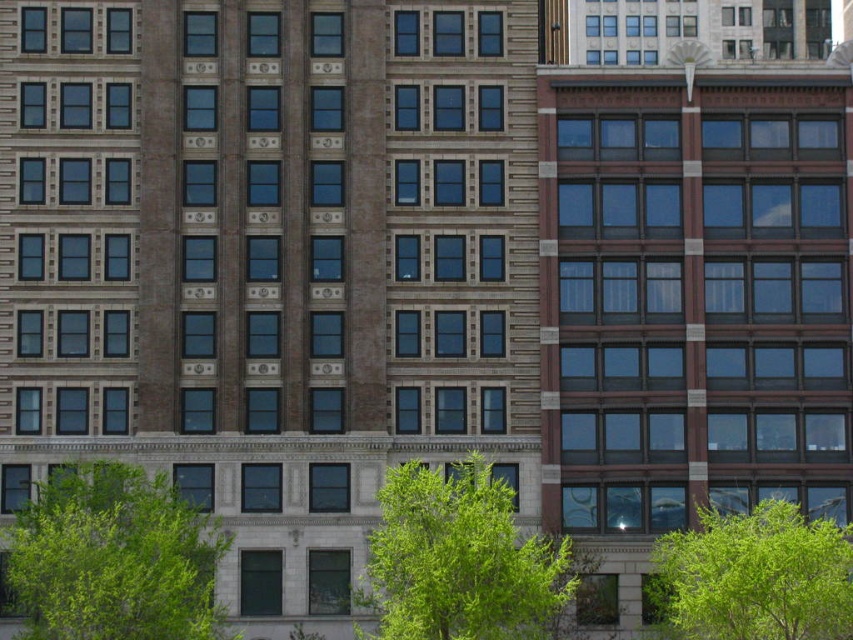
Question: Estimate the real-world distances between objects in this image. Which object is closer to the green leafy tree at lower center?

Choices:
 (A) green leafy tree at lower right
 (B) green leafy tree at lower left

Answer: (A)

Question: Can you confirm if green leafy tree at lower left is thinner than green leafy tree at lower center?

Choices:
 (A) no
 (B) yes

Answer: (A)

Question: Among these points, which one is nearest to the camera?

Choices:
 (A) (474, 577)
 (B) (672, 541)

Answer: (A)

Question: Which point is farther to the camera?

Choices:
 (A) (99, 609)
 (B) (433, 508)

Answer: (B)

Question: Is the position of green leafy tree at lower left less distant than that of green leafy tree at lower right?

Choices:
 (A) yes
 (B) no

Answer: (A)

Question: Does green leafy tree at lower center appear over green leafy tree at lower right?

Choices:
 (A) no
 (B) yes

Answer: (B)